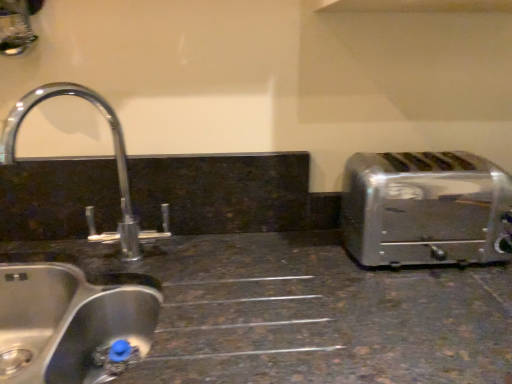
Question: Is satin silver toaster at right not inside brushed metal sink at left, arranged as the 2th sink when ordered from the bottom?

Choices:
 (A) yes
 (B) no

Answer: (A)

Question: Is satin silver toaster at right at the right side of brushed metal sink at left, arranged as the 2th sink when ordered from the bottom?

Choices:
 (A) yes
 (B) no

Answer: (A)

Question: Is the depth of satin silver toaster at right less than that of brushed metal sink at left, which is the first sink in top-to-bottom order?

Choices:
 (A) yes
 (B) no

Answer: (B)

Question: Does satin silver toaster at right touch brushed metal sink at left, arranged as the 2th sink when ordered from the bottom?

Choices:
 (A) yes
 (B) no

Answer: (B)

Question: Is satin silver toaster at right looking in the opposite direction of brushed metal sink at left, arranged as the 2th sink when ordered from the bottom?

Choices:
 (A) no
 (B) yes

Answer: (A)

Question: From the image's perspective, is brushed metal sink at left, which is the first sink in top-to-bottom order, positioned above or below stainless steel sink at lower left, which is the first sink in bottom-to-top order?

Choices:
 (A) above
 (B) below

Answer: (A)

Question: From a real-world perspective, relative to stainless steel sink at lower left, the 2th sink viewed from the top, is brushed metal sink at left, which is the first sink in top-to-bottom order, vertically above or below?

Choices:
 (A) below
 (B) above

Answer: (B)

Question: Is point (54, 332) positioned closer to the camera than point (13, 331)?

Choices:
 (A) farther
 (B) closer

Answer: (B)

Question: Relative to stainless steel sink at lower left, the 2th sink viewed from the top, is brushed metal sink at left, which is the first sink in top-to-bottom order, in front or behind?

Choices:
 (A) front
 (B) behind

Answer: (B)

Question: Considering the positions of stainless steel sink at lower left, the 2th sink viewed from the top, and satin silver toaster at right in the image, is stainless steel sink at lower left, the 2th sink viewed from the top, wider or thinner than satin silver toaster at right?

Choices:
 (A) wide
 (B) thin

Answer: (A)

Question: Is stainless steel sink at lower left, which is the first sink in bottom-to-top order, inside or outside of satin silver toaster at right?

Choices:
 (A) inside
 (B) outside

Answer: (B)

Question: Considering the positions of point (70, 327) and point (438, 233), is point (70, 327) closer or farther from the camera than point (438, 233)?

Choices:
 (A) closer
 (B) farther

Answer: (A)

Question: Is stainless steel sink at lower left, which is the first sink in bottom-to-top order, taller or shorter than satin silver toaster at right?

Choices:
 (A) short
 (B) tall

Answer: (B)

Question: Is brushed metal sink at left, arranged as the 2th sink when ordered from the bottom, spatially inside satin silver toaster at right, or outside of it?

Choices:
 (A) outside
 (B) inside

Answer: (A)

Question: Based on their positions, is brushed metal sink at left, which is the first sink in top-to-bottom order, located to the left or right of satin silver toaster at right?

Choices:
 (A) left
 (B) right

Answer: (A)